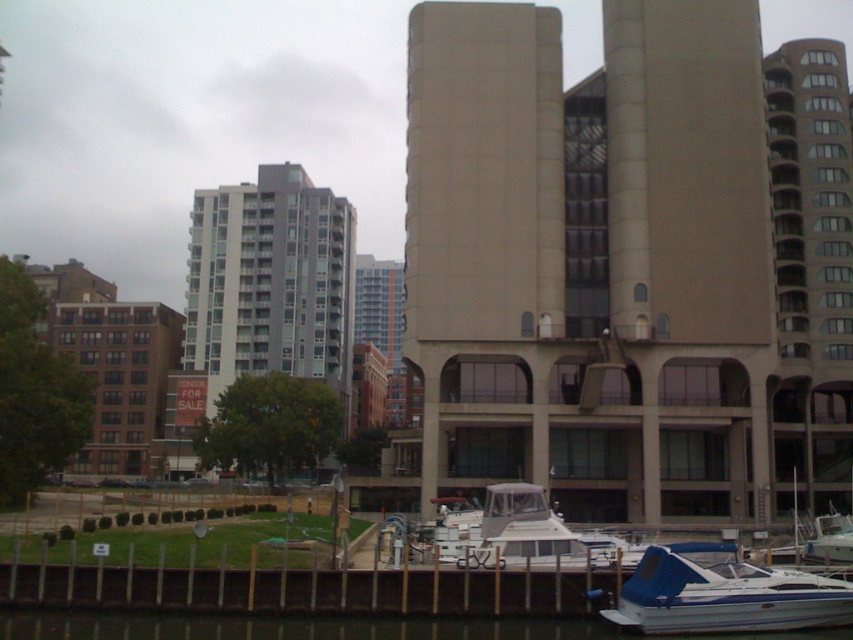
Question: Is blue vinyl boat at lower right to the left of white matte boat at center from the viewer's perspective?

Choices:
 (A) yes
 (B) no

Answer: (B)

Question: Which object is closer to the camera taking this photo?

Choices:
 (A) white matte boat at center
 (B) blue vinyl boat at lower right

Answer: (B)

Question: Which of the following is the farthest from the observer?

Choices:
 (A) blue vinyl boat at lower right
 (B) white matte boat at center

Answer: (B)

Question: Which object appears closest to the camera in this image?

Choices:
 (A) blue vinyl boat at lower right
 (B) white matte boat at center

Answer: (A)

Question: Is the position of blue vinyl boat at lower right less distant than that of white matte boat at center?

Choices:
 (A) yes
 (B) no

Answer: (A)

Question: Is blue vinyl boat at lower right closer to camera compared to white matte boat at center?

Choices:
 (A) yes
 (B) no

Answer: (A)